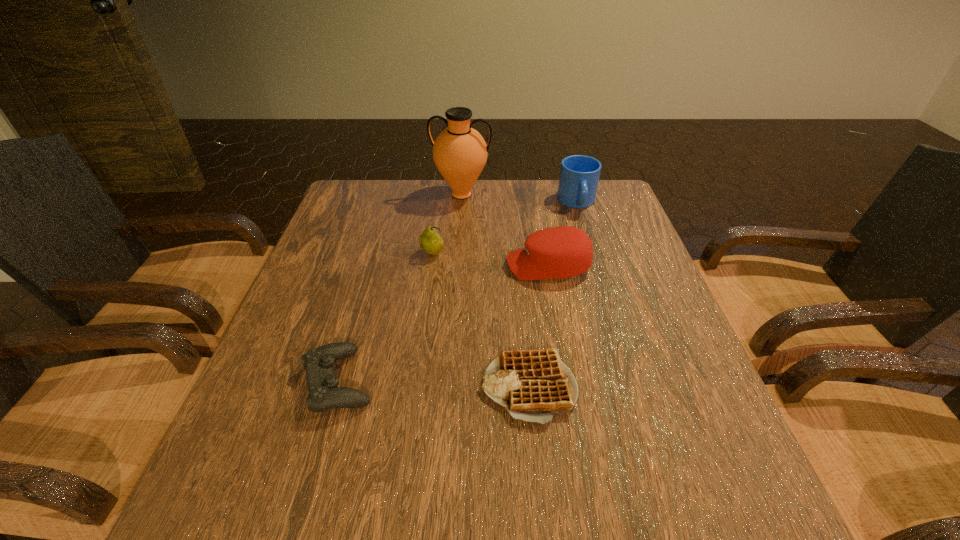
Where is `vacant area situated on the front-facing side of the cap`? The image size is (960, 540). vacant area situated on the front-facing side of the cap is located at coordinates [x=415, y=266].

In order to click on vacant space located 0.150m on the front-facing side of the cap in this screenshot , I will do `click(446, 266)`.

The width and height of the screenshot is (960, 540). In order to click on vacant region located 0.160m on the back of the pear in this screenshot , I will do `click(438, 214)`.

In order to click on vacant space positioned on the front of the leftmost object in this screenshot , I will do `click(319, 451)`.

At what (x,y) coordinates should I click in order to perform the action: click on vacant position located on the left of the shortest object. Please return your answer as a coordinate pair (x, y). The image size is (960, 540). Looking at the image, I should click on (414, 387).

You are a GUI agent. You are given a task and a screenshot of the screen. Output one action in this format:
    pyautogui.click(x=<x>, y=<y>)
    Task: Click on the pitcher at the far edge
    
    Given the screenshot: What is the action you would take?
    pyautogui.click(x=460, y=153)

You are a GUI agent. You are given a task and a screenshot of the screen. Output one action in this format:
    pyautogui.click(x=<x>, y=<y>)
    Task: Click on the mug located in the far edge section of the desktop
    The width and height of the screenshot is (960, 540).
    Given the screenshot: What is the action you would take?
    pyautogui.click(x=579, y=175)

The width and height of the screenshot is (960, 540). What are the coordinates of `object present at the left edge` in the screenshot? It's located at (324, 394).

The height and width of the screenshot is (540, 960). I want to click on mug that is at the right edge, so click(579, 175).

Image resolution: width=960 pixels, height=540 pixels. I want to click on cap located at the right edge, so click(560, 252).